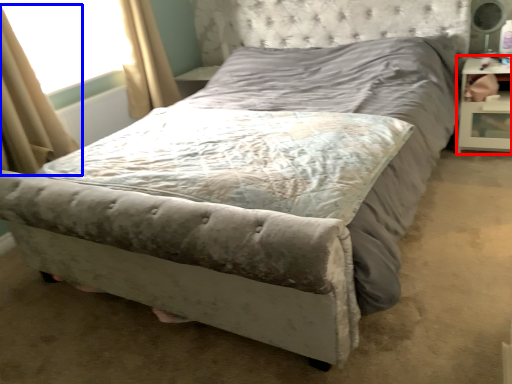
Question: Which of the following is the farthest to the observer, nightstand (highlighted by a red box) or curtain (highlighted by a blue box)?

Choices:
 (A) nightstand
 (B) curtain

Answer: (A)